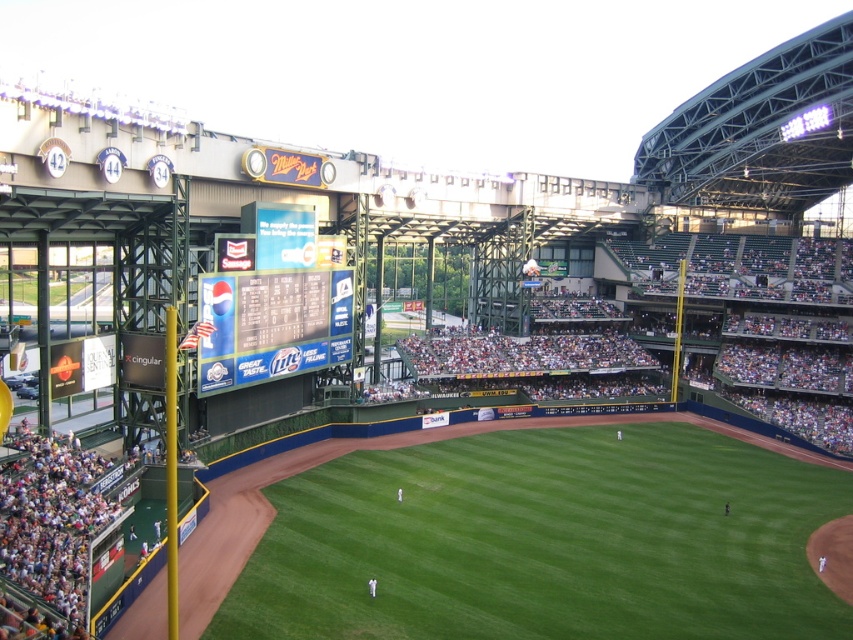
Question: Among these points, which one is farthest from the camera?

Choices:
 (A) pos(703,342)
 (B) pos(663,595)
 (C) pos(270,364)

Answer: (A)

Question: Can you confirm if green grass field at center is positioned above blue glossy scoreboard at center?

Choices:
 (A) yes
 (B) no

Answer: (B)

Question: Which object appears closest to the camera in this image?

Choices:
 (A) green grass field at center
 (B) blue glossy scoreboard at center

Answer: (A)

Question: Which of the following is the farthest from the observer?

Choices:
 (A) (335, 276)
 (B) (840, 282)

Answer: (B)

Question: Is dark green seats at center bigger than blue glossy scoreboard at center?

Choices:
 (A) yes
 (B) no

Answer: (A)

Question: Is green grass field at center positioned in front of blue glossy scoreboard at center?

Choices:
 (A) no
 (B) yes

Answer: (B)